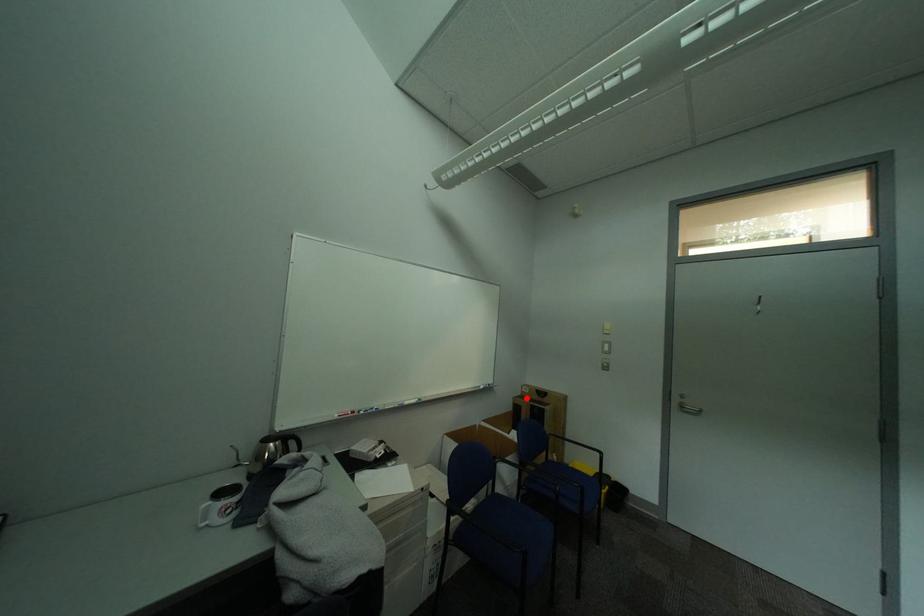
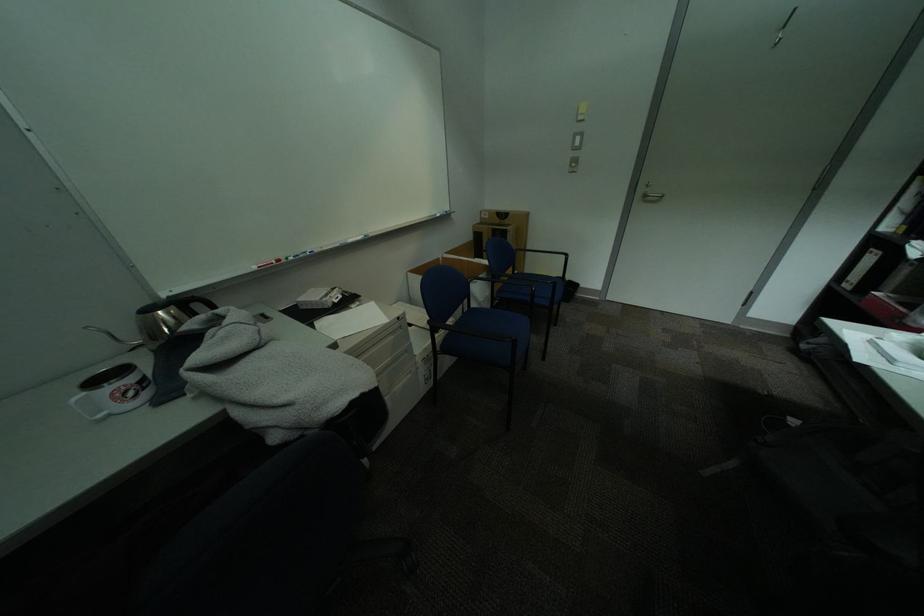
Question: I am providing you with two images of the same scene from different viewpoints. Given a red point in image1, look at the same physical point in image2. Is it:

Choices:
 (A) Closer to the viewpoint
 (B) Farther from the viewpoint

Answer: (A)